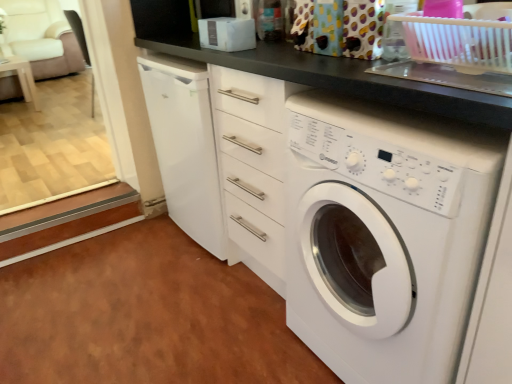
You are a GUI agent. You are given a task and a screenshot of the screen. Output one action in this format:
    pyautogui.click(x=<x>, y=<y>)
    Task: Click on the vacant area that is in front of pink plastic basket at upper right
    Image resolution: width=512 pixels, height=384 pixels.
    Given the screenshot: What is the action you would take?
    pyautogui.click(x=445, y=81)